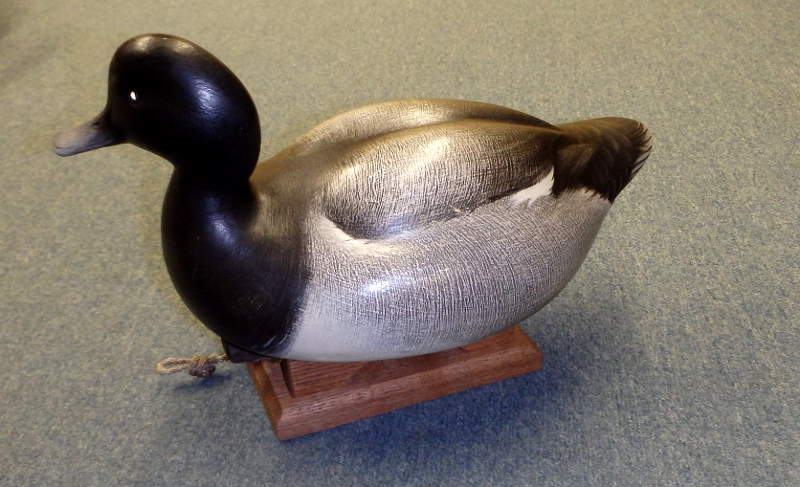
At what (x,y) coordinates should I click in order to perform the action: click on gray carpet. Please return your answer as a coordinate pair (x, y). Looking at the image, I should click on (586, 66).